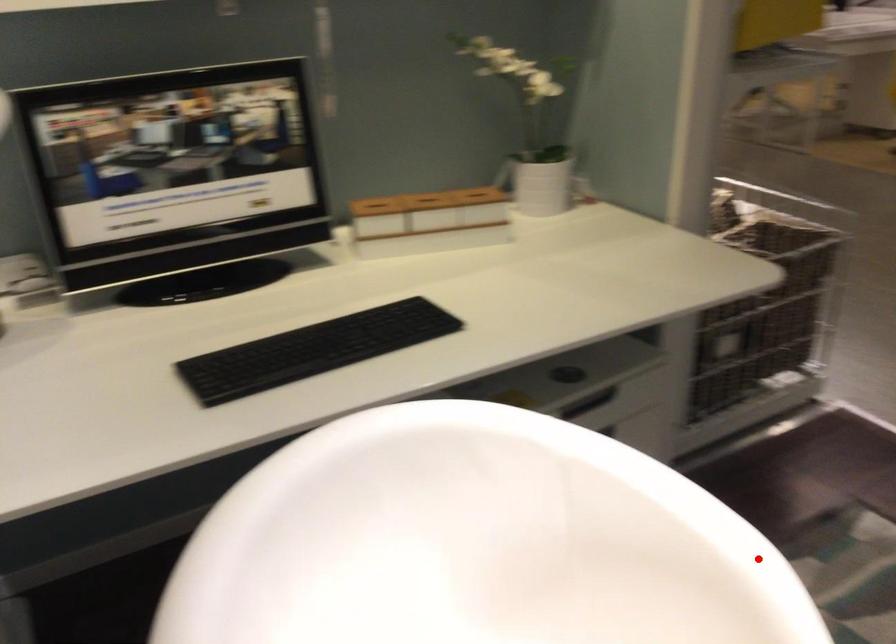
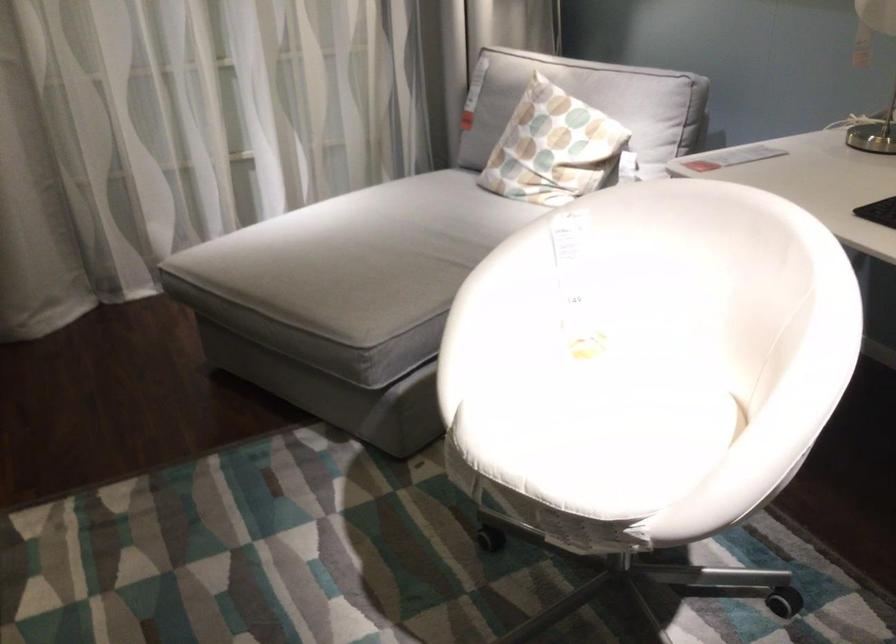
Question: A red point is marked in image1. In image2, is the corresponding 3D point closer to the camera or farther? Reply with the corresponding letter.

Choices:
 (A) The corresponding 3D point is closer.
 (B) The corresponding 3D point is farther.

Answer: (B)